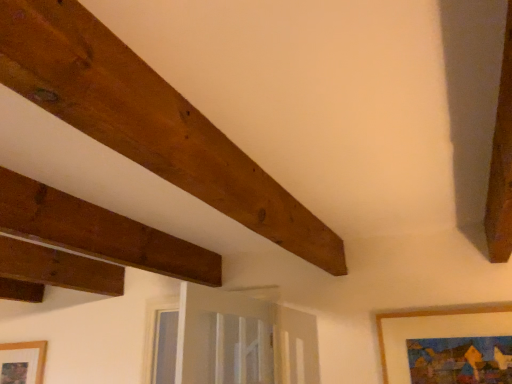
Question: Does brown wooden plank at upper left lie behind wooden framed painting at lower right, the 1th picture frame viewed from the top?

Choices:
 (A) no
 (B) yes

Answer: (A)

Question: Does brown wooden plank at upper left have a lesser height compared to wooden framed painting at lower right, acting as the 2th picture frame starting from the bottom?

Choices:
 (A) no
 (B) yes

Answer: (B)

Question: Does brown wooden plank at upper left turn towards wooden framed painting at lower right, acting as the 2th picture frame starting from the bottom?

Choices:
 (A) no
 (B) yes

Answer: (A)

Question: From a real-world perspective, is brown wooden plank at upper left on top of wooden framed painting at lower right, the 1th picture frame viewed from the top?

Choices:
 (A) yes
 (B) no

Answer: (A)

Question: Is brown wooden plank at upper left positioned beyond the bounds of wooden framed painting at lower right, the 2th picture frame in the left-to-right sequence?

Choices:
 (A) yes
 (B) no

Answer: (A)

Question: From the image's perspective, is brown wooden plank at upper left positioned above or below wooden picture frame at lower left, the second picture frame in the top-to-bottom sequence?

Choices:
 (A) above
 (B) below

Answer: (A)

Question: From a real-world perspective, is brown wooden plank at upper left physically located above or below wooden picture frame at lower left, which appears as the first picture frame when ordered from the bottom?

Choices:
 (A) below
 (B) above

Answer: (B)

Question: In the image, is brown wooden plank at upper left positioned in front of or behind wooden picture frame at lower left, arranged as the 1th picture frame when viewed from the back?

Choices:
 (A) behind
 (B) front

Answer: (B)

Question: In terms of width, does brown wooden plank at upper left look wider or thinner when compared to wooden picture frame at lower left, which appears as the first picture frame when ordered from the bottom?

Choices:
 (A) thin
 (B) wide

Answer: (B)

Question: Considering the positions of brown wooden plank at upper left and wooden framed painting at lower right, the first picture frame when ordered from right to left, in the image, is brown wooden plank at upper left taller or shorter than wooden framed painting at lower right, the first picture frame when ordered from right to left,?

Choices:
 (A) short
 (B) tall

Answer: (A)

Question: Based on their sizes in the image, would you say brown wooden plank at upper left is bigger or smaller than wooden framed painting at lower right, the first picture frame when ordered from right to left?

Choices:
 (A) small
 (B) big

Answer: (B)

Question: From a real-world perspective, is brown wooden plank at upper left above or below wooden framed painting at lower right, acting as the 2th picture frame starting from the bottom?

Choices:
 (A) above
 (B) below

Answer: (A)

Question: From the image's perspective, is brown wooden plank at upper left above or below wooden framed painting at lower right, the 2th picture frame in the left-to-right sequence?

Choices:
 (A) above
 (B) below

Answer: (A)

Question: Considering the positions of wooden picture frame at lower left, the second picture frame in the top-to-bottom sequence, and brown wooden plank at upper left in the image, is wooden picture frame at lower left, the second picture frame in the top-to-bottom sequence, wider or thinner than brown wooden plank at upper left?

Choices:
 (A) thin
 (B) wide

Answer: (A)

Question: From a real-world perspective, is wooden picture frame at lower left, which is the 2th picture frame in front-to-back order, above or below brown wooden plank at upper left?

Choices:
 (A) above
 (B) below

Answer: (B)